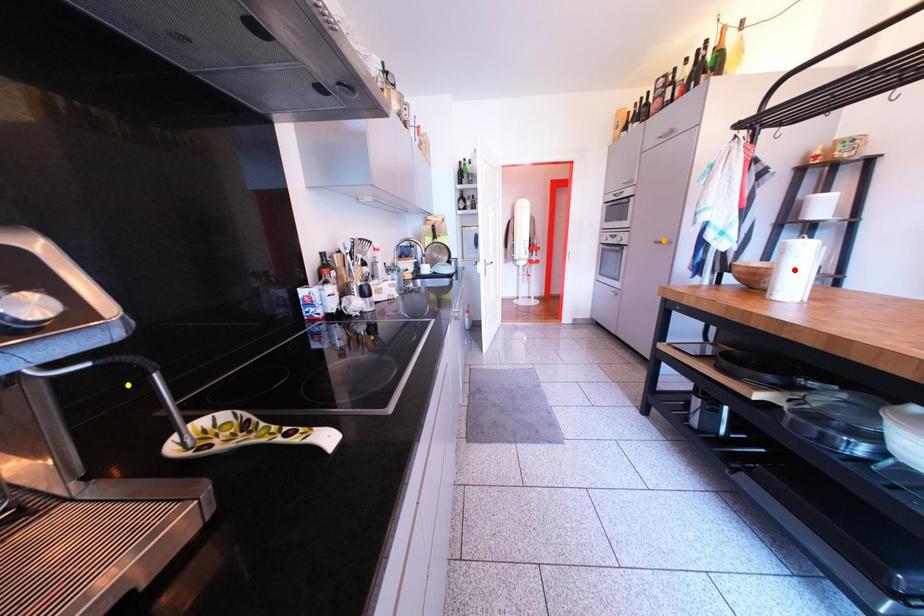
Order these from nearest to farthest:
1. yellow point
2. orange point
3. red point

yellow point → red point → orange point